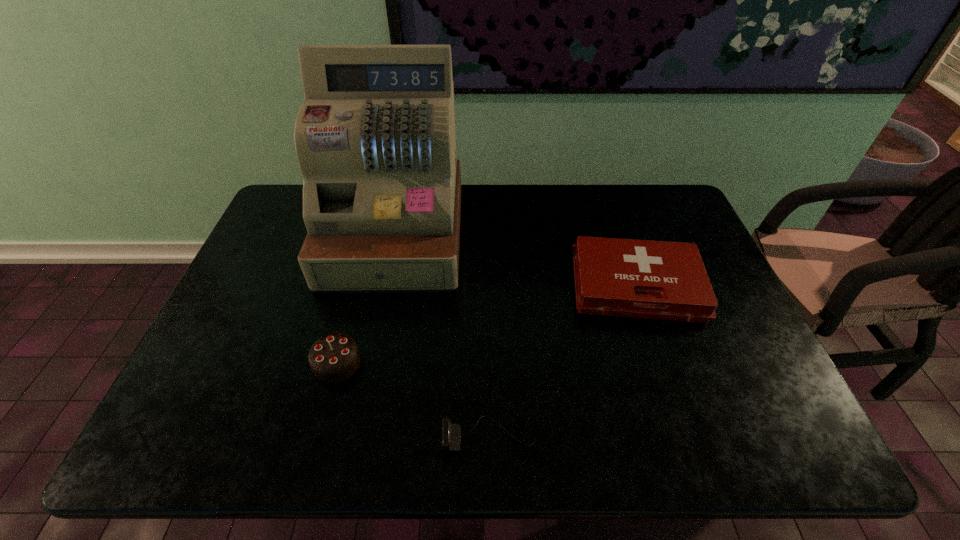
You are a GUI agent. You are given a task and a screenshot of the screen. Output one action in this format:
    pyautogui.click(x=<x>, y=<y>)
    Task: Click on the vacant region between the nearest object and the third shortest object
    The height and width of the screenshot is (540, 960).
    Given the screenshot: What is the action you would take?
    413,399

Locate an element on the screen. unoccupied position between the nearest object and the chocolate cake is located at coordinates (413, 399).

This screenshot has width=960, height=540. I want to click on the third closest object to the chocolate cake, so click(x=662, y=280).

Locate an element on the screen. This screenshot has height=540, width=960. object that is the second closest to the third shortest object is located at coordinates [451, 433].

Where is `vacant region that satisfies the following two spatial constraints: 1. on the operating side of the cash register; 2. on the right side of the rightmost object`? The image size is (960, 540). vacant region that satisfies the following two spatial constraints: 1. on the operating side of the cash register; 2. on the right side of the rightmost object is located at coordinates (385, 286).

Where is `vacant space that satisfies the following two spatial constraints: 1. on the front side of the first-aid kit; 2. on the front-facing side of the shortest object`? The height and width of the screenshot is (540, 960). vacant space that satisfies the following two spatial constraints: 1. on the front side of the first-aid kit; 2. on the front-facing side of the shortest object is located at coordinates (686, 436).

Where is `vacant space that satisfies the following two spatial constraints: 1. on the operating side of the third tallest object; 2. on the left side of the tallest object`? vacant space that satisfies the following two spatial constraints: 1. on the operating side of the third tallest object; 2. on the left side of the tallest object is located at coordinates (385, 286).

Find the location of `vacant space that satisfies the following two spatial constraints: 1. on the back side of the rightmost object; 2. on the left side of the second tallest object`. vacant space that satisfies the following two spatial constraints: 1. on the back side of the rightmost object; 2. on the left side of the second tallest object is located at coordinates (357, 286).

What are the coordinates of `vacant region that satisfies the following two spatial constraints: 1. on the operating side of the tallest object; 2. on the right side of the rightmost object` in the screenshot? It's located at (385, 286).

In order to click on blank space that satisfies the following two spatial constraints: 1. on the front side of the third tallest object; 2. on the front-facing side of the webcam in this screenshot , I will do `click(686, 436)`.